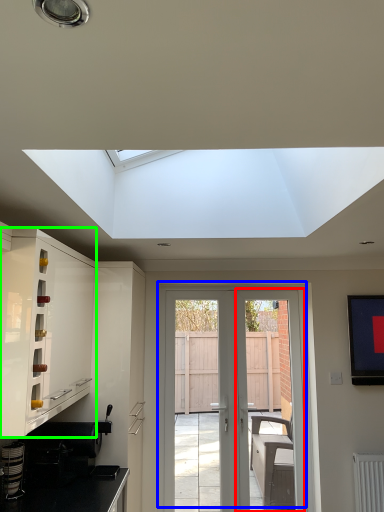
Question: Which is farther away from screen door (highlighted by a red box)? door (highlighted by a blue box) or cabinetry (highlighted by a green box)?

Choices:
 (A) door
 (B) cabinetry

Answer: (B)